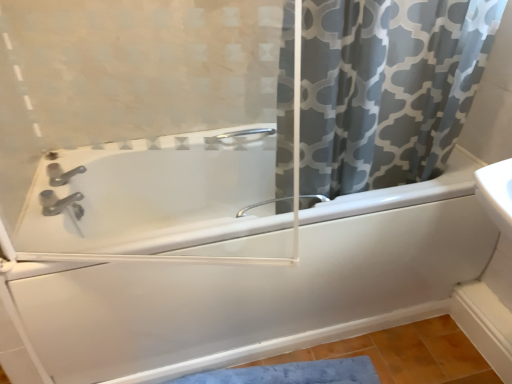
Question: Looking at the image, does white glossy bathtub at center seem bigger or smaller compared to satin nickel faucet at center?

Choices:
 (A) big
 (B) small

Answer: (A)

Question: Would you say white glossy bathtub at center is to the left or to the right of satin nickel faucet at center in the picture?

Choices:
 (A) right
 (B) left

Answer: (B)

Question: Estimate the real-world distances between objects in this image. Which object is closer to the satin nickel faucet at lower left?

Choices:
 (A) white glossy bathtub at center
 (B) transparent glass screen door at upper center
 (C) gray printed fabric curtain at upper right
 (D) satin nickel faucet at center

Answer: (B)

Question: Based on their relative distances, which object is farther from the satin nickel faucet at center?

Choices:
 (A) gray printed fabric curtain at upper right
 (B) white glossy bathtub at center
 (C) transparent glass screen door at upper center
 (D) satin nickel faucet at lower left

Answer: (D)